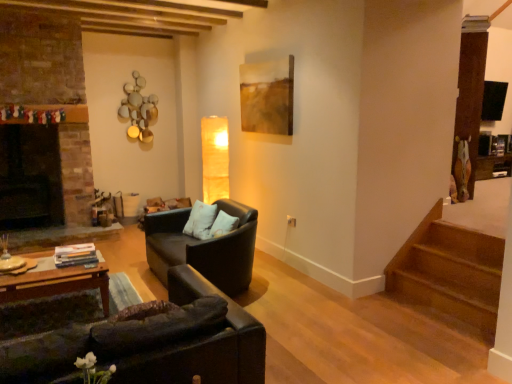
Question: Can you confirm if matte black couch at center, the second studio couch viewed from the front, is shorter than black leather couch at lower left, which ranks as the first studio couch in front-to-back order?

Choices:
 (A) no
 (B) yes

Answer: (B)

Question: From a real-world perspective, does matte black couch at center, positioned as the 1th studio couch in back-to-front order, stand above black leather couch at lower left, marked as the 2th studio couch in a back-to-front arrangement?

Choices:
 (A) no
 (B) yes

Answer: (A)

Question: Can you confirm if matte black couch at center, positioned as the 1th studio couch in back-to-front order, is bigger than black leather couch at lower left, which ranks as the first studio couch in front-to-back order?

Choices:
 (A) yes
 (B) no

Answer: (A)

Question: Is the depth of matte black couch at center, positioned as the 1th studio couch in back-to-front order, less than that of black leather couch at lower left, marked as the 2th studio couch in a back-to-front arrangement?

Choices:
 (A) no
 (B) yes

Answer: (A)

Question: Can you confirm if matte black couch at center, the second studio couch viewed from the front, is thinner than black leather couch at lower left, marked as the 2th studio couch in a back-to-front arrangement?

Choices:
 (A) no
 (B) yes

Answer: (B)

Question: Based on their sizes in the image, would you say matte brown painting at upper center is bigger or smaller than wooden coffee table at lower left?

Choices:
 (A) big
 (B) small

Answer: (B)

Question: Is matte brown painting at upper center wider or thinner than wooden coffee table at lower left?

Choices:
 (A) thin
 (B) wide

Answer: (A)

Question: Is matte brown painting at upper center in front of or behind wooden coffee table at lower left in the image?

Choices:
 (A) front
 (B) behind

Answer: (B)

Question: In terms of height, does matte brown painting at upper center look taller or shorter compared to wooden coffee table at lower left?

Choices:
 (A) tall
 (B) short

Answer: (A)

Question: From their relative heights in the image, would you say black leather couch at lower left, which ranks as the first studio couch in front-to-back order, is taller or shorter than matte black couch at center, the second studio couch viewed from the front?

Choices:
 (A) tall
 (B) short

Answer: (A)

Question: Considering their positions, is black leather couch at lower left, marked as the 2th studio couch in a back-to-front arrangement, located in front of or behind matte black couch at center, the second studio couch viewed from the front?

Choices:
 (A) front
 (B) behind

Answer: (A)

Question: Does point (147, 347) appear closer or farther from the camera than point (158, 256)?

Choices:
 (A) closer
 (B) farther

Answer: (A)

Question: From the image's perspective, is black leather couch at lower left, which ranks as the first studio couch in front-to-back order, positioned above or below matte black couch at center, positioned as the 1th studio couch in back-to-front order?

Choices:
 (A) below
 (B) above

Answer: (A)

Question: Is matte brown painting at upper center inside the boundaries of black leather couch at lower left, which ranks as the first studio couch in front-to-back order, or outside?

Choices:
 (A) inside
 (B) outside

Answer: (B)

Question: Is point (271, 99) positioned closer to the camera than point (96, 332)?

Choices:
 (A) farther
 (B) closer

Answer: (A)